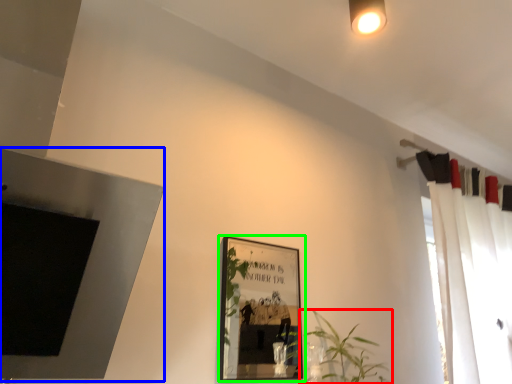
Question: Considering the real-world distances, which object is closest to houseplant (highlighted by a red box)? fireplace (highlighted by a blue box) or picture frame (highlighted by a green box).

Choices:
 (A) fireplace
 (B) picture frame

Answer: (A)